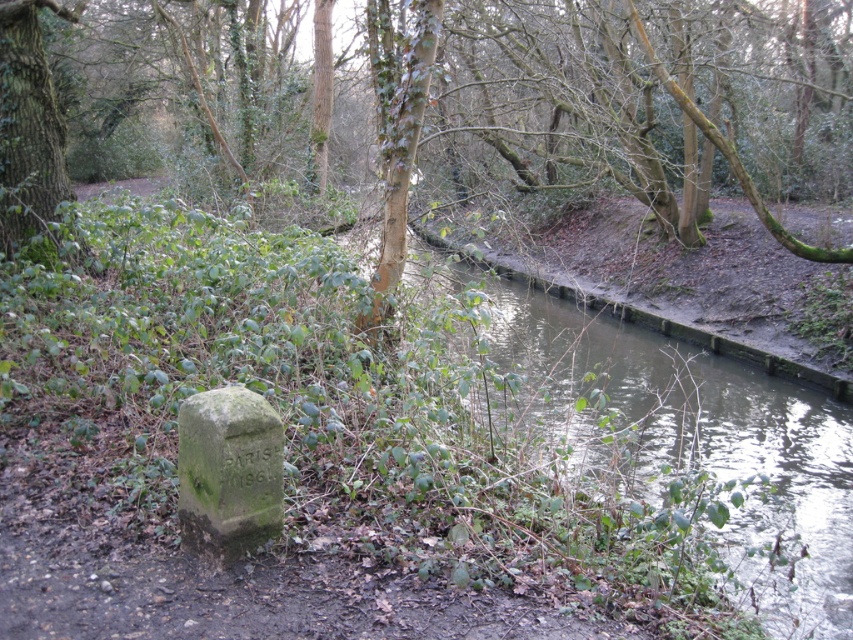
Question: Which point is farther from the camera taking this photo?

Choices:
 (A) (33, 170)
 (B) (190, 420)
 (C) (831, 532)

Answer: (A)

Question: Which of the following is the closest to the observer?

Choices:
 (A) green mossy bank at center
 (B) green rough bark tree at upper left

Answer: (A)

Question: Is green mossy bank at center below green rough bark tree at upper left?

Choices:
 (A) no
 (B) yes

Answer: (B)

Question: Can you confirm if green mossy bank at center is positioned above green rough bark tree at upper left?

Choices:
 (A) no
 (B) yes

Answer: (A)

Question: Is green mossy bank at center positioned before green mossy stone at lower left?

Choices:
 (A) yes
 (B) no

Answer: (B)

Question: Which point appears closest to the camera in this image?

Choices:
 (A) (554, 381)
 (B) (26, 209)

Answer: (B)